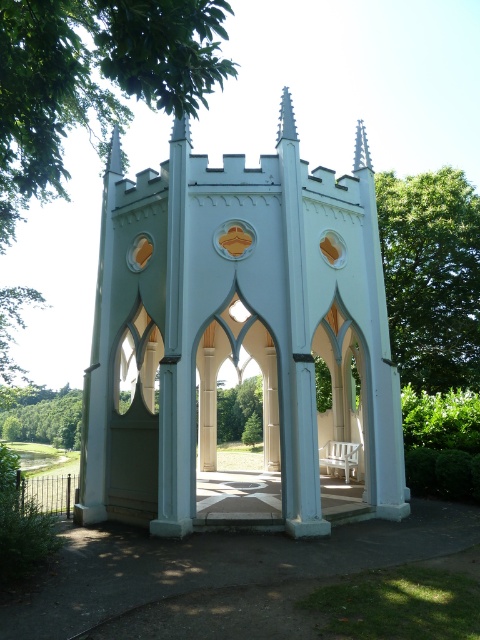
Who is lower down, green leafy tree at upper center or green leafy tree at upper right?

green leafy tree at upper right

Does green leafy tree at upper center have a larger size compared to green leafy tree at upper right?

Indeed, green leafy tree at upper center has a larger size compared to green leafy tree at upper right.

Who is more forward, (50,166) or (408,218)?

Point (50,166) is in front.

Locate an element on the screen. green leafy tree at upper center is located at coordinates coord(92,77).

Who is more forward, (x=166, y=211) or (x=43, y=426)?

Point (x=166, y=211)

Describe the element at coordinates (239, 332) in the screenshot. I see `white smooth gazebo at center` at that location.

The height and width of the screenshot is (640, 480). I want to click on white smooth gazebo at center, so pyautogui.click(x=239, y=332).

You are a GUI agent. You are given a task and a screenshot of the screen. Output one action in this format:
    pyautogui.click(x=<x>, y=<y>)
    Task: Click on the white smooth gazebo at center
    This screenshot has height=640, width=480.
    Given the screenshot: What is the action you would take?
    pyautogui.click(x=239, y=332)

Is green leafy tree at upper right below green leafy tree at lower left?

Actually, green leafy tree at upper right is above green leafy tree at lower left.

Can you confirm if green leafy tree at upper right is positioned to the left of green leafy tree at lower left?

In fact, green leafy tree at upper right is to the right of green leafy tree at lower left.

In order to click on green leafy tree at upper right in this screenshot , I will do (432, 276).